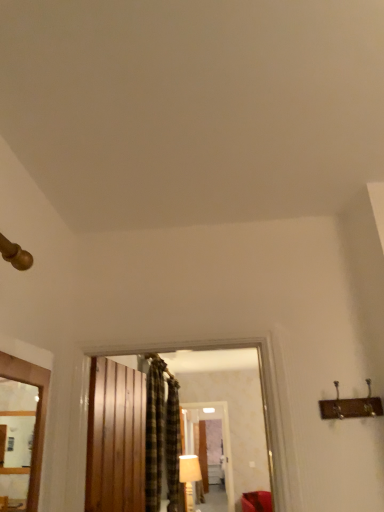
Question: Considering the relative sizes of wooden frame at left and white fabric lampshade at center in the image provided, is wooden frame at left bigger than white fabric lampshade at center?

Choices:
 (A) yes
 (B) no

Answer: (B)

Question: Can you confirm if wooden frame at left is thinner than white fabric lampshade at center?

Choices:
 (A) yes
 (B) no

Answer: (A)

Question: Does wooden frame at left come behind white fabric lampshade at center?

Choices:
 (A) no
 (B) yes

Answer: (A)

Question: Considering the relative sizes of wooden frame at left and white fabric lampshade at center in the image provided, is wooden frame at left smaller than white fabric lampshade at center?

Choices:
 (A) yes
 (B) no

Answer: (A)

Question: Is wooden frame at left to the right of white fabric lampshade at center from the viewer's perspective?

Choices:
 (A) no
 (B) yes

Answer: (A)

Question: In the image, is wooden barn door at center positioned in front of or behind matte wooden mirror at center?

Choices:
 (A) behind
 (B) front

Answer: (B)

Question: Visually, is wooden barn door at center positioned to the left or to the right of matte wooden mirror at center?

Choices:
 (A) right
 (B) left

Answer: (B)

Question: From the image's perspective, is wooden barn door at center positioned above or below matte wooden mirror at center?

Choices:
 (A) above
 (B) below

Answer: (A)

Question: Is wooden barn door at center bigger or smaller than matte wooden mirror at center?

Choices:
 (A) small
 (B) big

Answer: (A)

Question: Does point (190, 499) appear closer or farther from the camera than point (231, 486)?

Choices:
 (A) closer
 (B) farther

Answer: (A)

Question: From a real-world perspective, relative to matte wooden mirror at center, is white fabric lampshade at center vertically above or below?

Choices:
 (A) above
 (B) below

Answer: (B)

Question: Would you say white fabric lampshade at center is inside or outside matte wooden mirror at center?

Choices:
 (A) inside
 (B) outside

Answer: (B)

Question: Visually, is white fabric lampshade at center positioned to the left or to the right of matte wooden mirror at center?

Choices:
 (A) right
 (B) left

Answer: (B)

Question: From the image's perspective, is plaid fabric curtain at center, placed as the second curtain when sorted from back to front, positioned above or below matte wooden mirror at center?

Choices:
 (A) below
 (B) above

Answer: (B)

Question: Relative to matte wooden mirror at center, is plaid fabric curtain at center, placed as the second curtain when sorted from back to front, in front or behind?

Choices:
 (A) behind
 (B) front

Answer: (B)